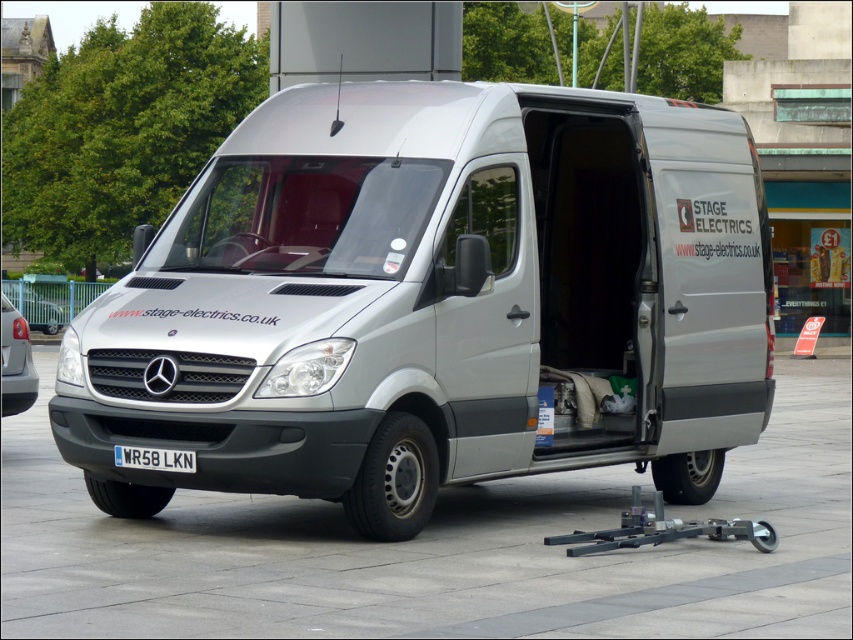
You are a delivery driver who needs to park your vehicle between the satin silver van at center and the silver metallic van at left. Can your 2.5 meter wide truck fit in the space between them?

The satin silver van at center is wider than the silver metallic van at left. However, the exact distance between them isn not provided, so it is impossible to determine if the 2.5 meter wide truck can fit.

You are a delivery driver who needs to park your satin silver van at center close to the curb. The parking rule states that the white plastic license plate at center must be visible from the street. Considering the distance between them, will the license plate be visible if you park the van as close as possible to the curb?

The satin silver van at center is 90.84 centimeters away from the white plastic license plate at center. Since the license plate is attached to the van, parking the van close to the curb will still keep the white plastic license plate at center visible from the street.

You are standing at a distance from the Mercedes Benz Sprinter van parked in the plaza. There is a point at coordinates point (9, 404). Can you estimate how far this point is from you in meters?

The point at point (9, 404) is 13.69 meters away from the viewer.